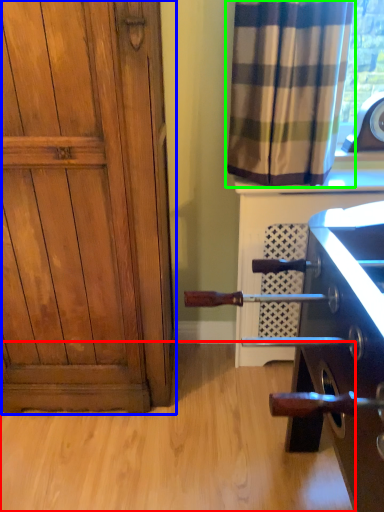
Question: Based on their relative distances, which object is farther from plain (highlighted by a red box)? Choose from door (highlighted by a blue box) and curtain (highlighted by a green box).

Choices:
 (A) door
 (B) curtain

Answer: (B)